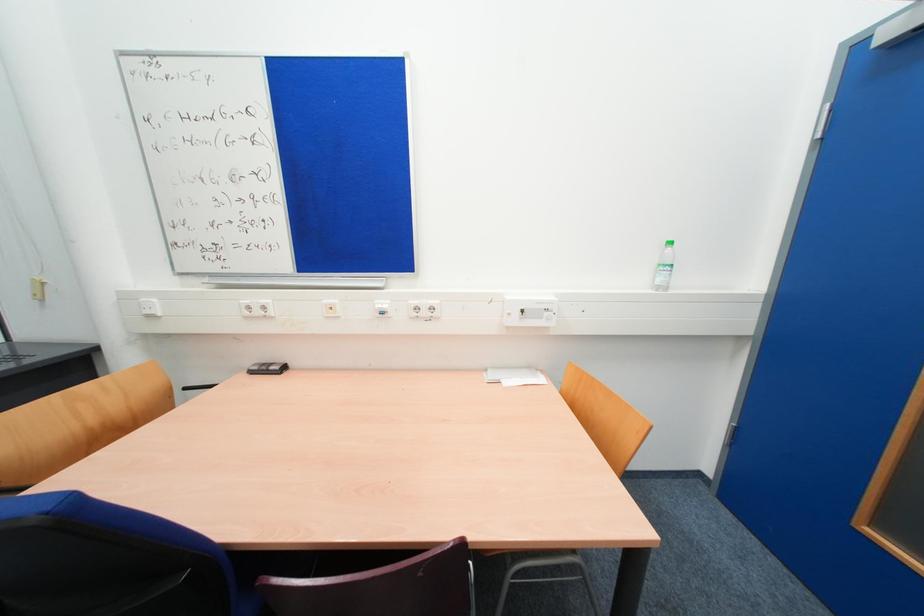
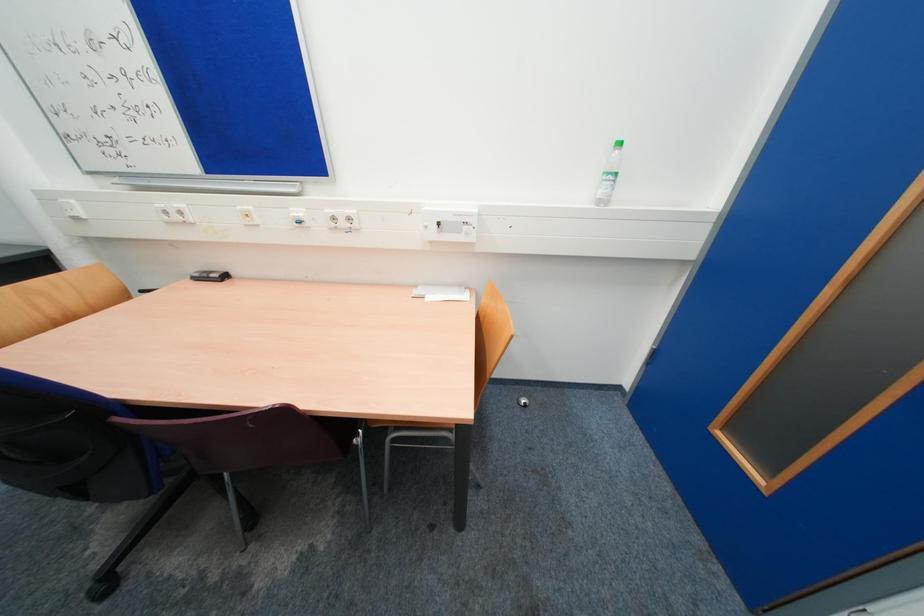
Question: How did the camera likely rotate?

Choices:
 (A) Left
 (B) Right
 (C) Up
 (D) Down

Answer: (D)